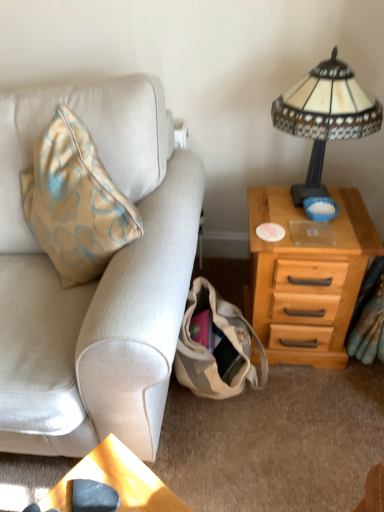
The image size is (384, 512). I want to click on vacant space in stained glass lampshade at upper right (from a real-world perspective), so click(x=303, y=206).